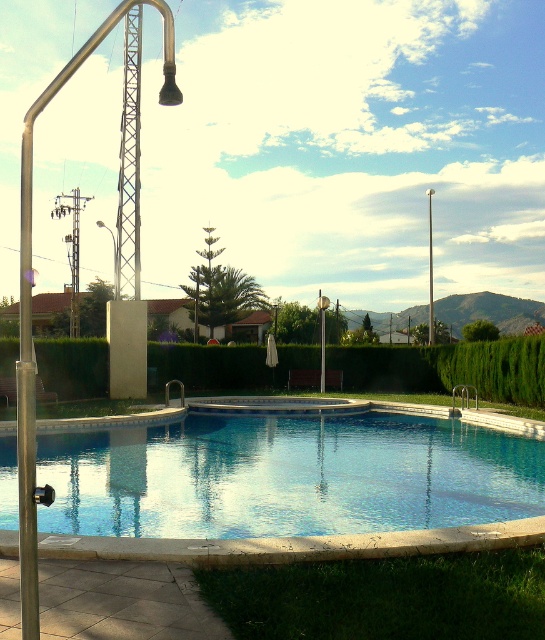
You are standing at the edge of the pool and want to locate both the silver metallic pole at left and the smooth white pole at upper center. Which pole is positioned further to the left side of the pool?

The silver metallic pole at left is positioned further to the left side of the pool compared to the smooth white pole at upper center.

You are designing a safety inspection route for the pool area and need to ensure that both the silver metallic pole at left and the smooth white pole at upper center are accessible for inspection. Based on their positions, which pole would you check first if you start from the pool edge and move towards the center?

The silver metallic pole at left should be checked first because it is positioned over the smooth white pole at upper center, meaning it is closer to the pool edge where you start your inspection route.